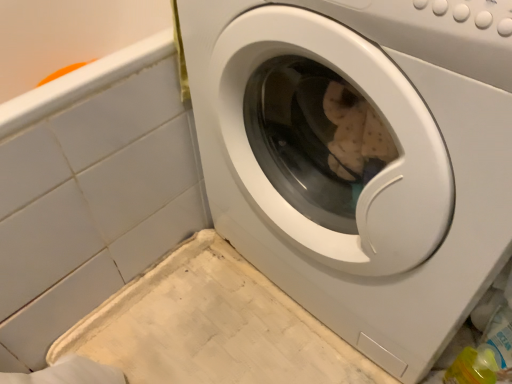
Question: Considering their positions, is white glossy washing machine at center located in front of or behind white glossy washing machine at center?

Choices:
 (A) behind
 (B) front

Answer: (B)

Question: From a real-world perspective, is white glossy washing machine at center above or below white glossy washing machine at center?

Choices:
 (A) above
 (B) below

Answer: (A)

Question: Would you say white glossy washing machine at center is inside or outside white glossy washing machine at center?

Choices:
 (A) outside
 (B) inside

Answer: (A)

Question: Is white glossy washing machine at center in front of or behind white glossy washing machine at center in the image?

Choices:
 (A) front
 (B) behind

Answer: (B)

Question: From the image's perspective, relative to white glossy washing machine at center, is white glossy washing machine at center above or below?

Choices:
 (A) below
 (B) above

Answer: (B)

Question: Is white glossy washing machine at center spatially inside white glossy washing machine at center, or outside of it?

Choices:
 (A) inside
 (B) outside

Answer: (B)

Question: Does point (113, 228) appear closer or farther from the camera than point (495, 129)?

Choices:
 (A) farther
 (B) closer

Answer: (A)